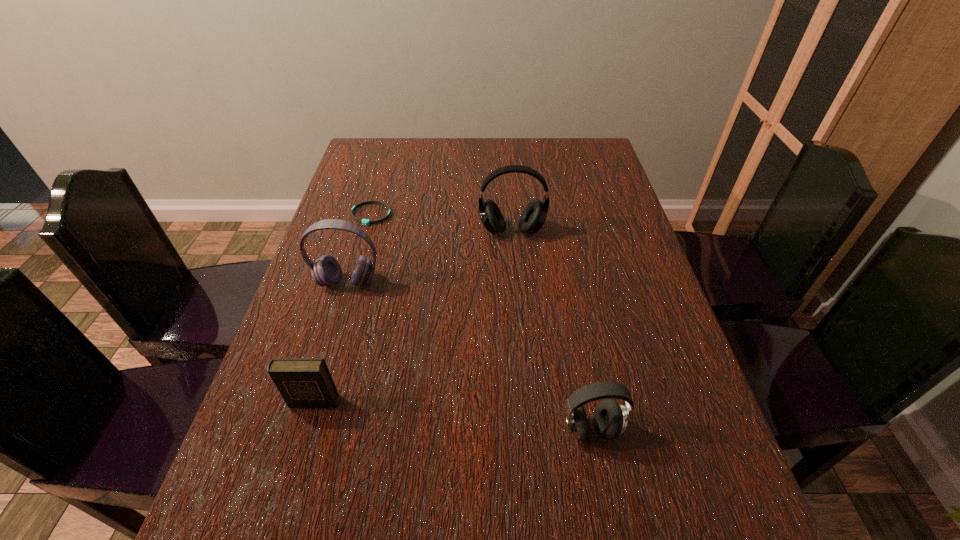
Where is `free location located 0.220m on the front cover of the fourth farthest object`? The image size is (960, 540). free location located 0.220m on the front cover of the fourth farthest object is located at coordinates (272, 539).

I want to click on vacant space positioned 0.300m on the buckle of the shortest object, so click(x=345, y=309).

The width and height of the screenshot is (960, 540). Find the location of `headset that is positioned at the left edge`. headset that is positioned at the left edge is located at coordinates (326, 271).

The height and width of the screenshot is (540, 960). Identify the location of diary located in the left edge section of the desktop. (302, 382).

Locate an element on the screen. wristband located in the left edge section of the desktop is located at coordinates (367, 222).

Locate an element on the screen. Image resolution: width=960 pixels, height=540 pixels. object that is positioned at the right edge is located at coordinates (610, 418).

Find the location of a particular element. The image size is (960, 540). vacant space at the far edge is located at coordinates (532, 149).

Find the location of `free space at the left edge of the desktop`. free space at the left edge of the desktop is located at coordinates (348, 219).

The width and height of the screenshot is (960, 540). I want to click on free location at the right edge, so click(676, 343).

Identify the location of blank space at the far left corner of the desktop. Image resolution: width=960 pixels, height=540 pixels. (360, 148).